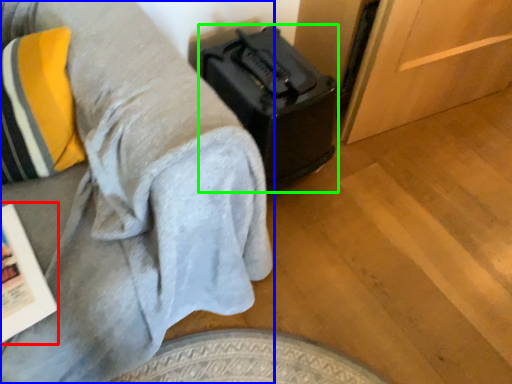
Question: Considering the real-world distances, which object is farthest from magazine (highlighted by a red box)? furniture (highlighted by a blue box) or luggage (highlighted by a green box)?

Choices:
 (A) furniture
 (B) luggage

Answer: (B)